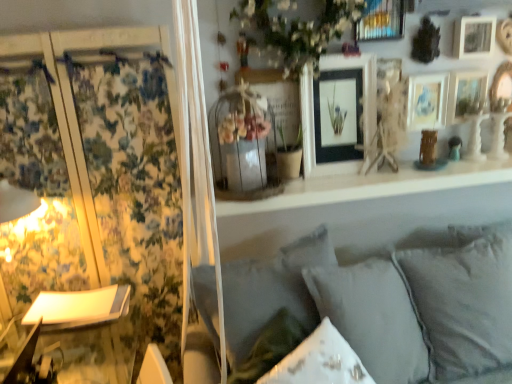
Question: Should I look upward or downward to see matte black picture frame at upper center, which is the first picture frame in left-to-right order?

Choices:
 (A) up
 (B) down

Answer: (A)

Question: Is the depth of metallic gold picture frame at upper center, the 2th picture frame positioned from the left, less than that of matte white picture frame at upper right, which appears as the 4th picture frame when viewed from the right?

Choices:
 (A) no
 (B) yes

Answer: (B)

Question: Considering the relative sizes of metallic gold picture frame at upper center, arranged as the fifth picture frame when viewed from the right, and matte white picture frame at upper right, the third picture frame when ordered from left to right, in the image provided, is metallic gold picture frame at upper center, arranged as the fifth picture frame when viewed from the right, wider than matte white picture frame at upper right, the third picture frame when ordered from left to right,?

Choices:
 (A) yes
 (B) no

Answer: (A)

Question: Can you confirm if metallic gold picture frame at upper center, arranged as the fifth picture frame when viewed from the right, is bigger than matte white picture frame at upper right, which appears as the 4th picture frame when viewed from the right?

Choices:
 (A) yes
 (B) no

Answer: (A)

Question: Would you say metallic gold picture frame at upper center, the 2th picture frame positioned from the left, is outside matte white picture frame at upper right, the third picture frame when ordered from left to right?

Choices:
 (A) yes
 (B) no

Answer: (A)

Question: Does metallic gold picture frame at upper center, the 2th picture frame positioned from the left, have a smaller size compared to matte white picture frame at upper right, the third picture frame when ordered from left to right?

Choices:
 (A) no
 (B) yes

Answer: (A)

Question: From the image's perspective, is metallic gold picture frame at upper center, the 2th picture frame positioned from the left, on matte white picture frame at upper right, which appears as the 4th picture frame when viewed from the right?

Choices:
 (A) yes
 (B) no

Answer: (A)

Question: Is white matte shelf at upper center facing away from gray fabric pillow at lower center, marked as the 2th pillow in a right-to-left arrangement?

Choices:
 (A) no
 (B) yes

Answer: (A)

Question: From a real-world perspective, does white matte shelf at upper center sit lower than gray fabric pillow at lower center, the 1th pillow in the left-to-right sequence?

Choices:
 (A) no
 (B) yes

Answer: (A)

Question: From the image's perspective, is white matte shelf at upper center on top of gray fabric pillow at lower center, marked as the 2th pillow in a right-to-left arrangement?

Choices:
 (A) no
 (B) yes

Answer: (B)

Question: Can you confirm if white matte shelf at upper center is bigger than gray fabric pillow at lower center, marked as the 2th pillow in a right-to-left arrangement?

Choices:
 (A) yes
 (B) no

Answer: (B)

Question: Does white matte shelf at upper center appear on the left side of gray fabric pillow at lower center, the 1th pillow in the left-to-right sequence?

Choices:
 (A) yes
 (B) no

Answer: (B)

Question: Are white matte shelf at upper center and gray fabric pillow at lower center, marked as the 2th pillow in a right-to-left arrangement, located far from each other?

Choices:
 (A) yes
 (B) no

Answer: (B)

Question: Is white soft cushions at lower right next to white matte flower at upper center and touching it?

Choices:
 (A) yes
 (B) no

Answer: (B)